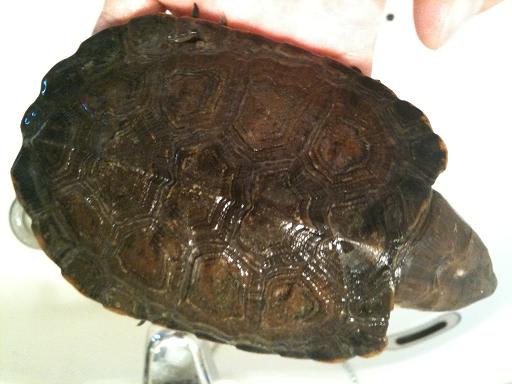
The width and height of the screenshot is (512, 384). I want to click on faucet, so click(x=182, y=360).